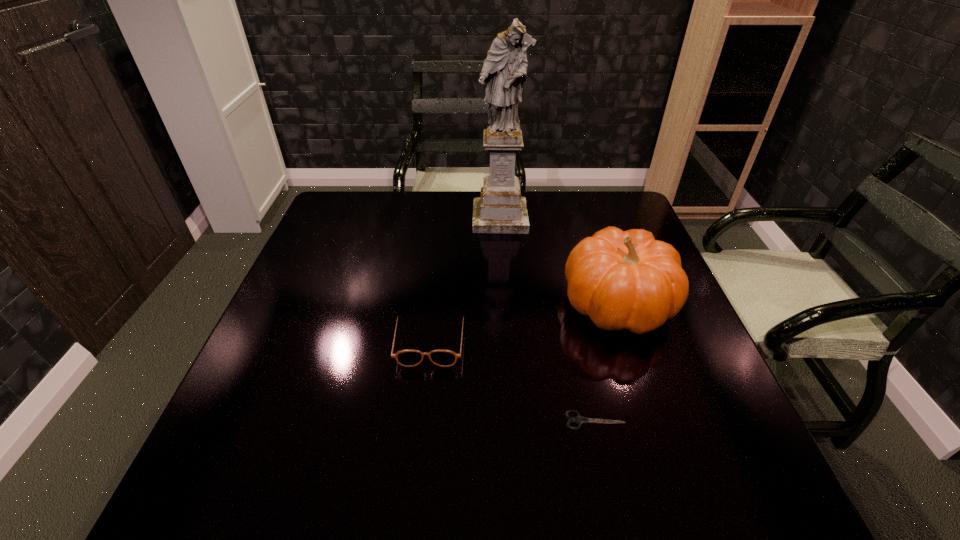
I want to click on free spot between the shears and the second shortest object, so click(513, 380).

At what (x,y) coordinates should I click in order to perform the action: click on vacant area between the second shortest object and the shears. Please return your answer as a coordinate pair (x, y). The height and width of the screenshot is (540, 960). Looking at the image, I should click on (513, 380).

At what (x,y) coordinates should I click in order to perform the action: click on vacant space that is in between the third tallest object and the farthest object. Please return your answer as a coordinate pair (x, y). The height and width of the screenshot is (540, 960). Looking at the image, I should click on (465, 279).

This screenshot has height=540, width=960. Identify the location of free space between the third shortest object and the leftmost object. (524, 322).

I want to click on vacant area between the shears and the tallest object, so click(547, 319).

Locate an element on the screen. Image resolution: width=960 pixels, height=540 pixels. vacant area that lies between the nearest object and the farthest object is located at coordinates (547, 319).

Locate an element on the screen. vacant area that lies between the sunglasses and the sculpture is located at coordinates (465, 279).

Identify the location of empty space between the second tallest object and the shortest object. (607, 362).

What are the coordinates of `unoccupied position between the pumpkin and the leftmost object` in the screenshot? It's located at tap(524, 322).

Find the location of `object that is the second closest to the shortest object`. object that is the second closest to the shortest object is located at coordinates (408, 358).